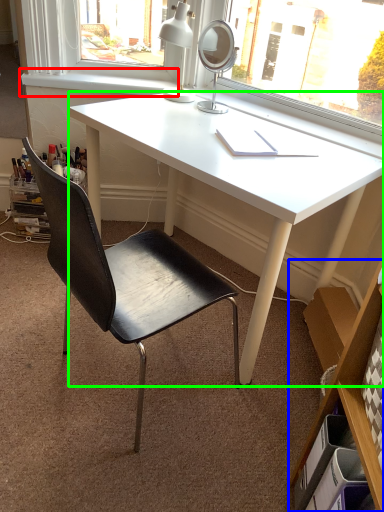
Question: Based on their relative distances, which object is farther from window sill (highlighted by a red box)? Choose from bookshelf (highlighted by a blue box) and desk (highlighted by a green box).

Choices:
 (A) bookshelf
 (B) desk

Answer: (A)